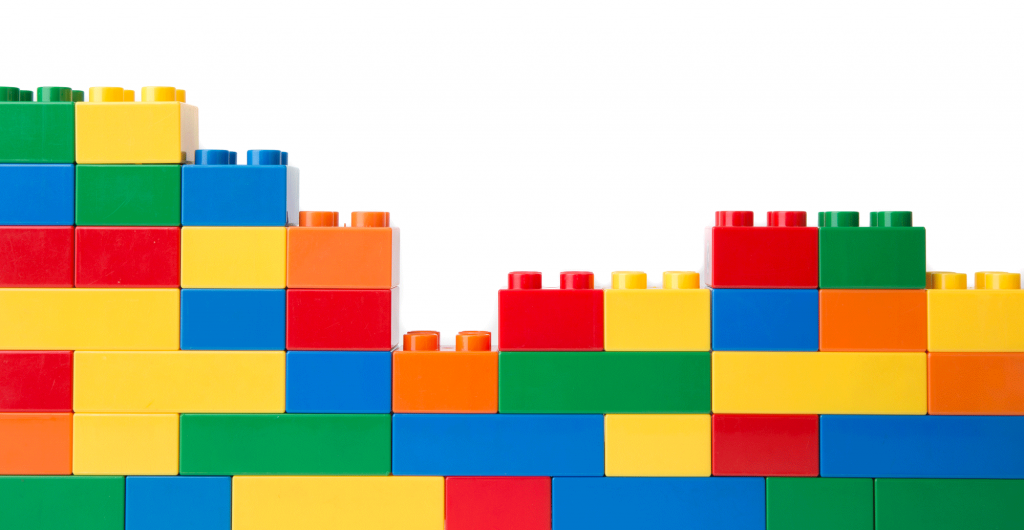
Image resolution: width=1024 pixels, height=530 pixels. Identify the location of red plastic building blocks. (31, 388), (39, 255), (124, 256), (326, 313), (496, 498), (566, 306), (768, 238), (745, 453).